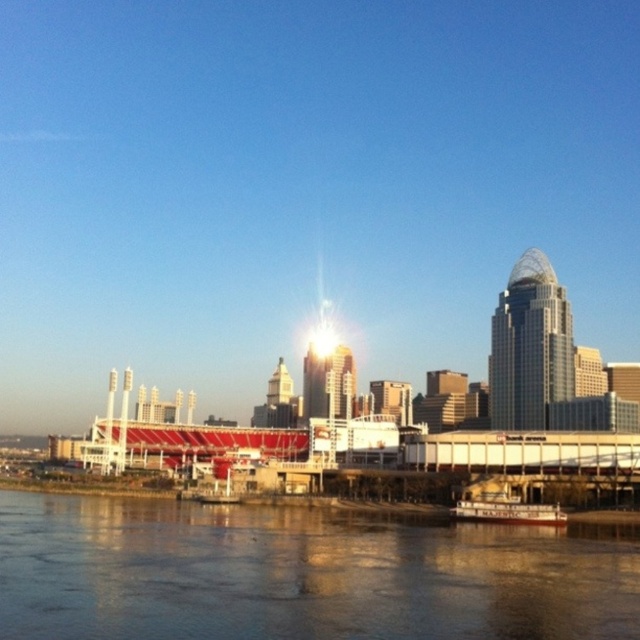
Question: Which object appears closest to the camera in this image?

Choices:
 (A) brown smooth water at lower center
 (B) white wooden boat at lower center

Answer: (A)

Question: Is brown smooth water at lower center wider than white wooden boat at lower center?

Choices:
 (A) no
 (B) yes

Answer: (B)

Question: Which point appears closest to the camera in this image?

Choices:
 (A) (314, 614)
 (B) (515, 516)

Answer: (A)

Question: Can you confirm if brown smooth water at lower center is positioned to the right of white wooden boat at lower center?

Choices:
 (A) yes
 (B) no

Answer: (B)

Question: Which of the following is the closest to the observer?

Choices:
 (A) (116, 513)
 (B) (486, 513)

Answer: (B)

Question: Does brown smooth water at lower center appear on the left side of white wooden boat at lower center?

Choices:
 (A) no
 (B) yes

Answer: (B)